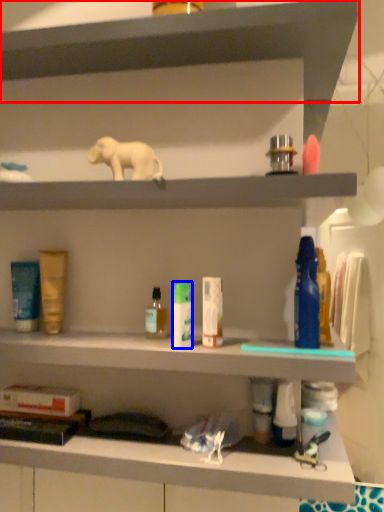
Question: Among these objects, which one is farthest to the camera, shelf (highlighted by a red box) or toiletry (highlighted by a blue box)?

Choices:
 (A) shelf
 (B) toiletry

Answer: (B)